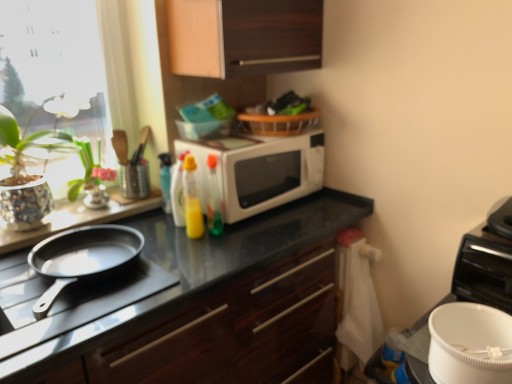
Question: Looking at the image, does translucent plastic spray bottle at upper center, marked as the fourth bottle in a right-to-left arrangement, seem bigger or smaller compared to green glossy vase at left?

Choices:
 (A) big
 (B) small

Answer: (B)

Question: From the image's perspective, relative to green glossy vase at left, is translucent plastic spray bottle at upper center, marked as the fourth bottle in a right-to-left arrangement, above or below?

Choices:
 (A) above
 (B) below

Answer: (B)

Question: Which of these objects is positioned farthest from the yellow translucent bottle at center, which is counted as the 2th bottle, starting from the left?

Choices:
 (A) white matte mixing bowl at lower right
 (B) glossy dark wood cabinet at center, acting as the 2th cabinetry starting from the top
 (C) green glossy vase at left
 (D) translucent plastic bottle at center, which is counted as the 4th bottle, starting from the left
 (E) white plastic bucket at lower right

Answer: (A)

Question: Estimate the real-world distances between objects in this image. Which object is farther from the translucent plastic bottle at center, the second bottle positioned from the right?

Choices:
 (A) green glossy vase at left
 (B) translucent plastic bottle at center, which is counted as the 4th bottle, starting from the left
 (C) black matte pan at left
 (D) yellow translucent bottle at center, which is counted as the 2th bottle, starting from the left
 (E) translucent plastic spray bottle at upper center, marked as the fourth bottle in a right-to-left arrangement

Answer: (A)